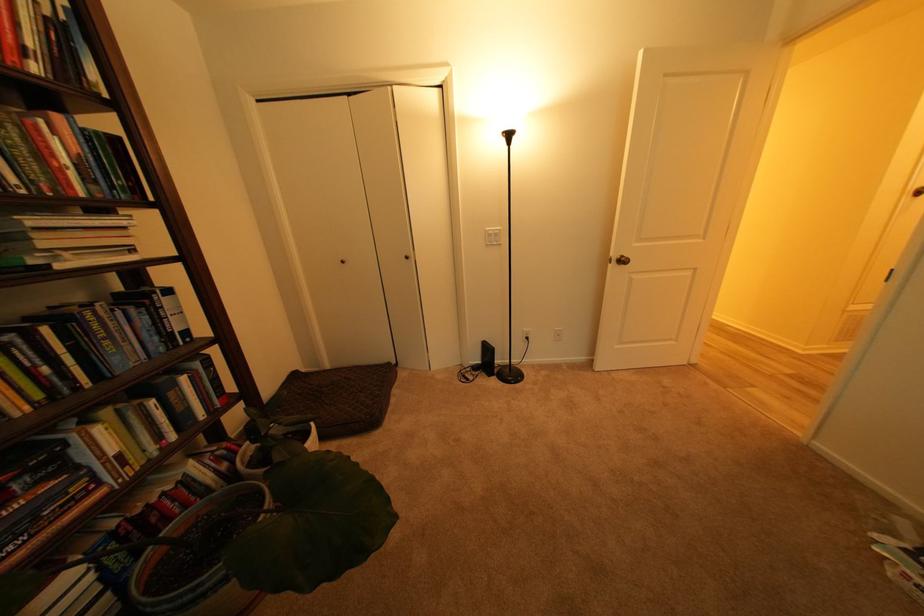
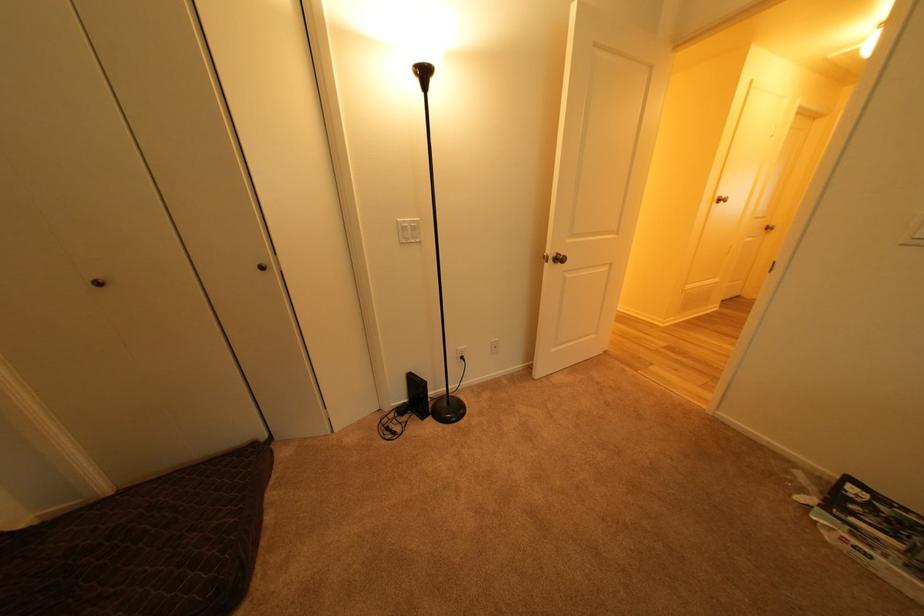
The point at [490,363] is marked in the first image. Where is the corresponding point in the second image?

(417, 402)